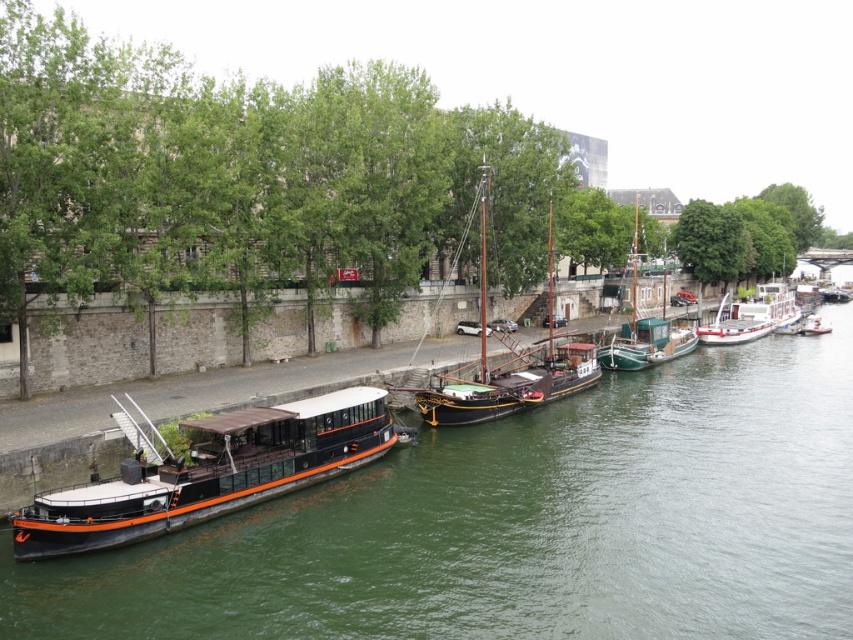
You are standing on the wooden dock and want to board the wooden sailboat at center. Which direction should you walk to reach it from the green water at lower left?

The wooden sailboat at center is taller than the green water at lower left, so you should walk towards the center where the wooden sailboat is located to board it.

You are standing on the riverside path and see the green water at lower left and the white glossy barge at right. Which object is closer to your left side?

The green water at lower left is closer to your left side because it is positioned to the left of the white glossy barge at right.